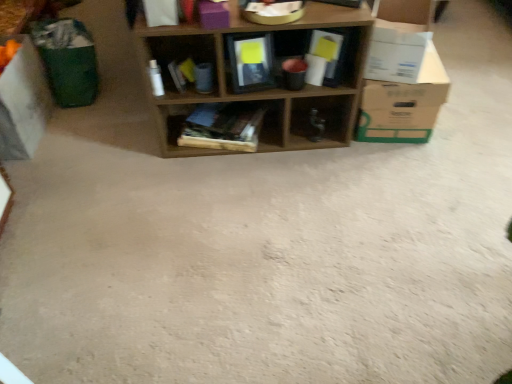
Where is `wooden books at center, the 2th shelf positioned from the right`? wooden books at center, the 2th shelf positioned from the right is located at coordinates (221, 126).

This screenshot has width=512, height=384. I want to click on white cardboard box at left, placed as the 1th cardboard box when sorted from left to right, so click(23, 103).

This screenshot has width=512, height=384. Identify the location of wooden shelf at center, which is the third shelf from left to right. (256, 90).

The height and width of the screenshot is (384, 512). Identify the location of white cardboard box at right, the 2th cardboard box from the left. (396, 51).

Locate an element on the screen. The height and width of the screenshot is (384, 512). wooden books at center, placed as the 2th shelf when sorted from left to right is located at coordinates (221, 126).

This screenshot has height=384, width=512. Identify the location of the 2nd shelf behind the wooden shelf at center, which is the third shelf from left to right. (221, 126).

Considering the positions of objects wooden books at center, placed as the 2th shelf when sorted from left to right, and wooden shelf at center, which is counted as the first shelf, starting from the right, in the image provided, who is behind, wooden books at center, placed as the 2th shelf when sorted from left to right, or wooden shelf at center, which is counted as the first shelf, starting from the right,?

wooden books at center, placed as the 2th shelf when sorted from left to right, is behind.

What's the angular difference between wooden books at center, the 2th shelf positioned from the right, and wooden shelf at center, which is the third shelf from left to right,'s facing directions?

The facing directions of wooden books at center, the 2th shelf positioned from the right, and wooden shelf at center, which is the third shelf from left to right, are 18 degrees apart.

Would you say wooden books at center, the 2th shelf positioned from the right, contains wooden shelf at center, which is counted as the first shelf, starting from the right?

No, wooden shelf at center, which is counted as the first shelf, starting from the right, is not a part of wooden books at center, the 2th shelf positioned from the right.

At what (x,y) coordinates should I click in order to perform the action: click on storage box on the right of wooden frame at center, the first shelf when ordered from left to right. Please return your answer as a coordinate pair (x, y). This screenshot has height=384, width=512. Looking at the image, I should click on (213, 14).

Considering the positions of objects wooden frame at center, the first shelf when ordered from left to right, and purple matte storage box at upper center in the image provided, who is more to the right, wooden frame at center, the first shelf when ordered from left to right, or purple matte storage box at upper center?

purple matte storage box at upper center is more to the right.

From a real-world perspective, which object stands above the other?

In real-world perspective, purple matte storage box at upper center is above.

Is wooden frame at center, the first shelf when ordered from left to right, not close to purple matte storage box at upper center?

No, there isn't a large distance between wooden frame at center, the first shelf when ordered from left to right, and purple matte storage box at upper center.

Does wooden frame at center, the first shelf when ordered from left to right, have a smaller size compared to wooden shelf at center, which is the third shelf from left to right?

Yes, wooden frame at center, the first shelf when ordered from left to right, is smaller than wooden shelf at center, which is the third shelf from left to right.

Is wooden frame at center, the first shelf when ordered from left to right, aimed at wooden shelf at center, which is counted as the first shelf, starting from the right?

Yes, wooden frame at center, the first shelf when ordered from left to right, is facing wooden shelf at center, which is counted as the first shelf, starting from the right.

Consider the image. Which is more to the left, wooden frame at center, the 3th shelf in the right-to-left sequence, or wooden shelf at center, which is the third shelf from left to right?

From the viewer's perspective, wooden frame at center, the 3th shelf in the right-to-left sequence, appears more on the left side.

From the picture: Which of these two, wooden frame at center, the 3th shelf in the right-to-left sequence, or wooden shelf at center, which is counted as the first shelf, starting from the right, stands taller?

→ With more height is wooden shelf at center, which is counted as the first shelf, starting from the right.

From a real-world perspective, between wooden shelf at center, which is counted as the first shelf, starting from the right, and purple matte storage box at upper center, who is vertically lower?

wooden shelf at center, which is counted as the first shelf, starting from the right.

From the image's perspective, is wooden shelf at center, which is counted as the first shelf, starting from the right, located beneath purple matte storage box at upper center?

Indeed, from the image's perspective, wooden shelf at center, which is counted as the first shelf, starting from the right, is shown beneath purple matte storage box at upper center.

Considering the positions of objects wooden shelf at center, which is counted as the first shelf, starting from the right, and purple matte storage box at upper center in the image provided, who is more to the right, wooden shelf at center, which is counted as the first shelf, starting from the right, or purple matte storage box at upper center?

wooden shelf at center, which is counted as the first shelf, starting from the right.

Which is more distant, (x=324, y=94) or (x=200, y=15)?

The point (x=324, y=94) is farther from the camera.

Is wooden frame at center, the first shelf when ordered from left to right, located within white cardboard box at left, acting as the 3th cardboard box starting from the right?

No, wooden frame at center, the first shelf when ordered from left to right, is not a part of white cardboard box at left, acting as the 3th cardboard box starting from the right.

There is a white cardboard box at left, placed as the 1th cardboard box when sorted from left to right. At what (x,y) coordinates should I click in order to perform the action: click on the 2nd shelf above it (from the image's perspective). Please return your answer as a coordinate pair (x, y). This screenshot has width=512, height=384. Looking at the image, I should click on (182, 58).

Is white cardboard box at left, placed as the 1th cardboard box when sorted from left to right, not near wooden frame at center, the first shelf when ordered from left to right?

No.

How different are the orientations of white cardboard box at left, placed as the 1th cardboard box when sorted from left to right, and wooden frame at center, the 3th shelf in the right-to-left sequence, in degrees?

The angular difference between white cardboard box at left, placed as the 1th cardboard box when sorted from left to right, and wooden frame at center, the 3th shelf in the right-to-left sequence, is 27.4 degrees.

What are the coordinates of `cardboard box located on the left of white cardboard box at right, the 2th cardboard box when ordered from right to left` in the screenshot? It's located at (23, 103).

Would you say white cardboard box at right, the 2th cardboard box when ordered from right to left, is a long distance from white cardboard box at left, placed as the 1th cardboard box when sorted from left to right?

white cardboard box at right, the 2th cardboard box when ordered from right to left, is positioned a significant distance from white cardboard box at left, placed as the 1th cardboard box when sorted from left to right.

Which object is wider, white cardboard box at right, the 2th cardboard box from the left, or white cardboard box at left, acting as the 3th cardboard box starting from the right?

Wider between the two is white cardboard box at right, the 2th cardboard box from the left.

Considering the sizes of objects wooden books at center, the 2th shelf positioned from the right, and purple matte storage box at upper center in the image provided, who is smaller, wooden books at center, the 2th shelf positioned from the right, or purple matte storage box at upper center?

purple matte storage box at upper center.

Which is correct: wooden books at center, placed as the 2th shelf when sorted from left to right, is inside purple matte storage box at upper center, or outside of it?

wooden books at center, placed as the 2th shelf when sorted from left to right, is outside purple matte storage box at upper center.

Considering the relative positions of wooden books at center, the 2th shelf positioned from the right, and purple matte storage box at upper center in the image provided, is wooden books at center, the 2th shelf positioned from the right, to the left of purple matte storage box at upper center from the viewer's perspective?

No.

From the image's perspective, is wooden books at center, placed as the 2th shelf when sorted from left to right, below purple matte storage box at upper center?

Indeed, from the image's perspective, wooden books at center, placed as the 2th shelf when sorted from left to right, is shown beneath purple matte storage box at upper center.

From a real-world perspective, starting from the wooden books at center, the 2th shelf positioned from the right, which shelf is the 1st one vertically above it? Please provide its 2D coordinates.

[(256, 90)]

At what (x,y) coordinates should I click in order to perform the action: click on shelf on the left side of purple matte storage box at upper center. Please return your answer as a coordinate pair (x, y). The width and height of the screenshot is (512, 384). Looking at the image, I should click on (182, 58).

Considering their positions, is white cardboard box at right, the 2th cardboard box from the left, positioned further to wooden shelf at center, which is the third shelf from left to right, than purple matte storage box at upper center?

Among the two, purple matte storage box at upper center is located further to wooden shelf at center, which is the third shelf from left to right.

Based on their spatial positions, is wooden frame at center, the 3th shelf in the right-to-left sequence, or purple matte storage box at upper center closer to white cardboard box at right, acting as the third cardboard box starting from the left?

Based on the image, wooden frame at center, the 3th shelf in the right-to-left sequence, appears to be nearer to white cardboard box at right, acting as the third cardboard box starting from the left.

Estimate the real-world distances between objects in this image. Which object is further from wooden shelf at center, which is counted as the first shelf, starting from the right, white cardboard box at right, the 2th cardboard box when ordered from right to left, or white cardboard box at right, acting as the third cardboard box starting from the left?

white cardboard box at right, the 2th cardboard box when ordered from right to left, is further to wooden shelf at center, which is counted as the first shelf, starting from the right.

Which object lies further to the anchor point wooden shelf at center, which is counted as the first shelf, starting from the right, wooden frame at center, the first shelf when ordered from left to right, or white cardboard box at left, acting as the 3th cardboard box starting from the right?

white cardboard box at left, acting as the 3th cardboard box starting from the right, lies further to wooden shelf at center, which is counted as the first shelf, starting from the right, than the other object.

Based on their spatial positions, is white cardboard box at left, acting as the 3th cardboard box starting from the right, or wooden shelf at center, which is counted as the first shelf, starting from the right, further from purple matte storage box at upper center?

white cardboard box at left, acting as the 3th cardboard box starting from the right, lies further to purple matte storage box at upper center than the other object.

When comparing their distances from purple matte storage box at upper center, does white cardboard box at right, the 2th cardboard box when ordered from right to left, or wooden books at center, the 2th shelf positioned from the right, seem further?

Based on the image, white cardboard box at right, the 2th cardboard box when ordered from right to left, appears to be further to purple matte storage box at upper center.

Estimate the real-world distances between objects in this image. Which object is closer to white cardboard box at right, the 2th cardboard box when ordered from right to left, white cardboard box at right, acting as the third cardboard box starting from the left, or purple matte storage box at upper center?

white cardboard box at right, acting as the third cardboard box starting from the left, lies closer to white cardboard box at right, the 2th cardboard box when ordered from right to left, than the other object.

Based on their spatial positions, is white cardboard box at right, the 2th cardboard box when ordered from right to left, or wooden books at center, placed as the 2th shelf when sorted from left to right, closer to wooden shelf at center, which is the third shelf from left to right?

wooden books at center, placed as the 2th shelf when sorted from left to right.

You are a GUI agent. You are given a task and a screenshot of the screen. Output one action in this format:
    pyautogui.click(x=<x>, y=<y>)
    Task: Click on the shelf situated between wooden books at center, placed as the 2th shelf when sorted from left to right, and white cardboard box at right, the 2th cardboard box from the left, from left to right
    
    Given the screenshot: What is the action you would take?
    pyautogui.click(x=256, y=90)

This screenshot has height=384, width=512. In order to click on shelf located between white cardboard box at left, acting as the 3th cardboard box starting from the right, and purple matte storage box at upper center in the left-right direction in this screenshot , I will do `click(182, 58)`.

Locate an element on the screen. The image size is (512, 384). storage box situated between wooden frame at center, the 3th shelf in the right-to-left sequence, and white cardboard box at right, the 2th cardboard box when ordered from right to left, from left to right is located at coordinates (213, 14).

I want to click on shelf between wooden shelf at center, which is the third shelf from left to right, and wooden books at center, placed as the 2th shelf when sorted from left to right, from front to back, so click(x=182, y=58).